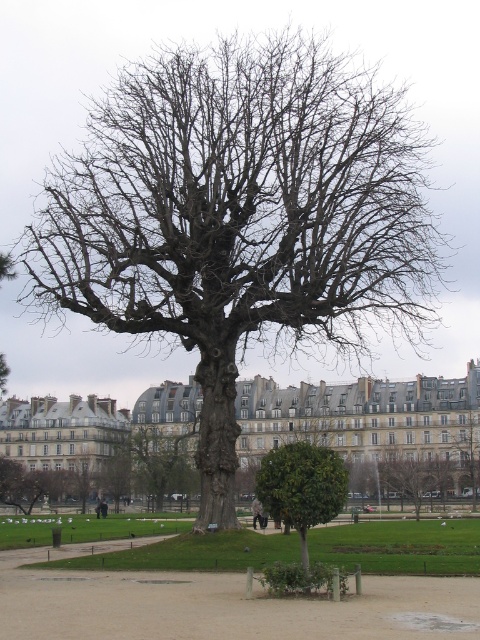
Question: Can you confirm if green grass at center is thinner than bare wood tree at center?

Choices:
 (A) yes
 (B) no

Answer: (B)

Question: Which point is farther to the camera?

Choices:
 (A) (299, 474)
 (B) (475, 497)

Answer: (B)

Question: From the image, what is the correct spatial relationship of green grass at center in relation to green leafy tree at center?

Choices:
 (A) left
 (B) right

Answer: (A)

Question: Can you confirm if green leafy tree at center is positioned above bare wood tree at center?

Choices:
 (A) yes
 (B) no

Answer: (A)

Question: Which point appears farthest from the camera in this image?

Choices:
 (A) (108, 589)
 (B) (273, 499)

Answer: (A)

Question: Which is nearer to the green grass at center?

Choices:
 (A) bare wood tree at center
 (B) green leafy tree at center

Answer: (B)